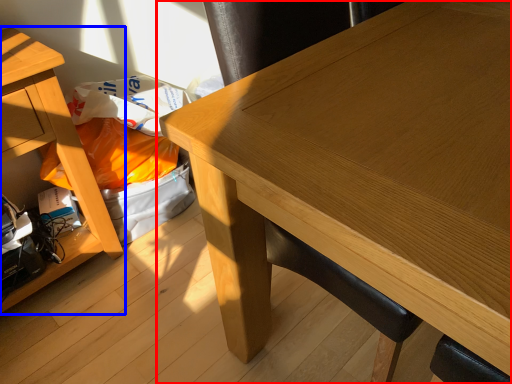
Question: Among these objects, which one is farthest to the camera, table (highlighted by a red box) or table (highlighted by a blue box)?

Choices:
 (A) table
 (B) table

Answer: (B)